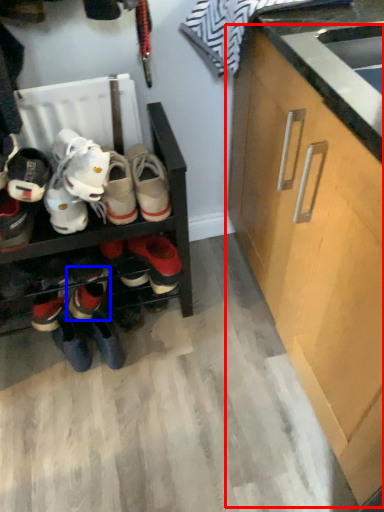
Question: Which of the following is the farthest to the observer, cabinetry (highlighted by a red box) or footwear (highlighted by a blue box)?

Choices:
 (A) cabinetry
 (B) footwear

Answer: (B)